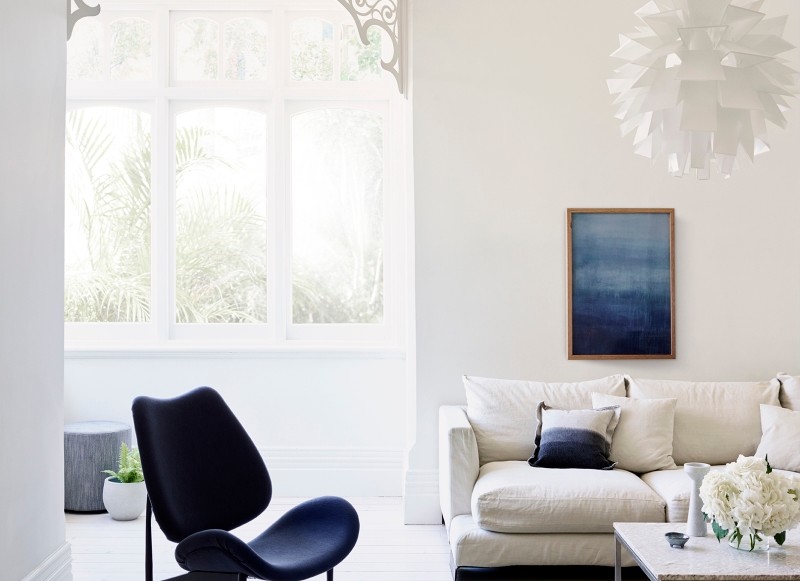
At what (x,y) coordinates should I click in order to perform the action: click on couch. Please return your answer as a coordinate pair (x, y). Looking at the image, I should click on (580, 480).